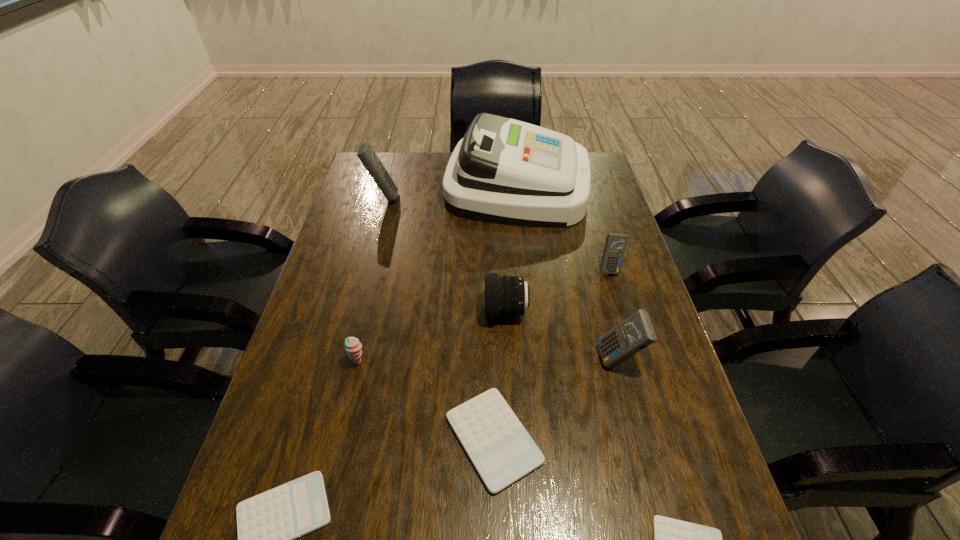
The width and height of the screenshot is (960, 540). Find the location of `the fourth tallest calculator`. the fourth tallest calculator is located at coordinates (501, 450).

Where is `the second white calculator from right to left`? This screenshot has height=540, width=960. the second white calculator from right to left is located at coordinates (501, 450).

The image size is (960, 540). I want to click on free space located on the front of the cash register, so click(x=523, y=244).

Locate an element on the screen. The height and width of the screenshot is (540, 960). vacant space located on the front-facing side of the leftmost blue calculator is located at coordinates (445, 197).

Find the location of a particular element. This screenshot has height=540, width=960. vacant area situated on the front-facing side of the fourth nearest calculator is located at coordinates (528, 360).

Locate an element on the screen. This screenshot has width=960, height=540. free space located 0.160m on the front-facing side of the fourth nearest calculator is located at coordinates (532, 360).

Identify the location of vacant area located 0.250m on the front-facing side of the fourth nearest calculator. (494, 360).

Locate an element on the screen. free space located at the front element of the telephoto lens is located at coordinates (375, 312).

At what (x,y) coordinates should I click in order to perform the action: click on vacant region located at the front element of the telephoto lens. Please return your answer as a coordinate pair (x, y). The width and height of the screenshot is (960, 540). Looking at the image, I should click on (428, 312).

At what (x,y) coordinates should I click in order to perform the action: click on vacant space situated 0.200m at the front element of the telephoto lens. Please return your answer as a coordinate pair (x, y). Image resolution: width=960 pixels, height=540 pixels. Looking at the image, I should click on (410, 312).